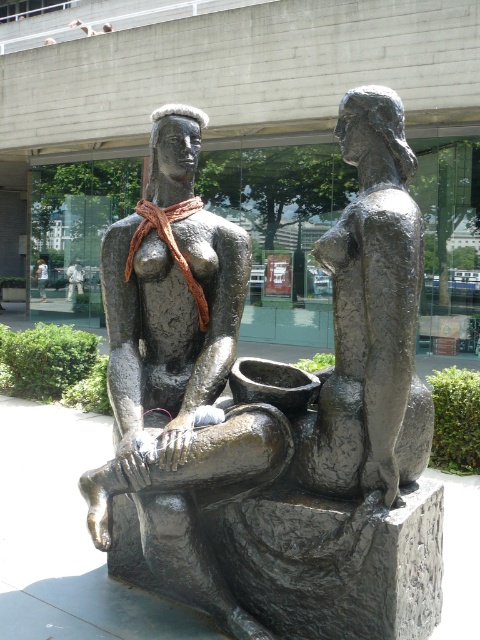
Can you confirm if bronze statue at center is bigger than matte bronze statue at center?

Indeed, bronze statue at center has a larger size compared to matte bronze statue at center.

Does bronze statue at center lie in front of matte bronze statue at center?

Yes, bronze statue at center is in front of matte bronze statue at center.

Describe the element at coordinates (276, 419) in the screenshot. The height and width of the screenshot is (640, 480). I see `bronze statue at center` at that location.

At what (x,y) coordinates should I click in order to perform the action: click on bronze statue at center. Please return your answer as a coordinate pair (x, y). The height and width of the screenshot is (640, 480). Looking at the image, I should click on (276, 419).